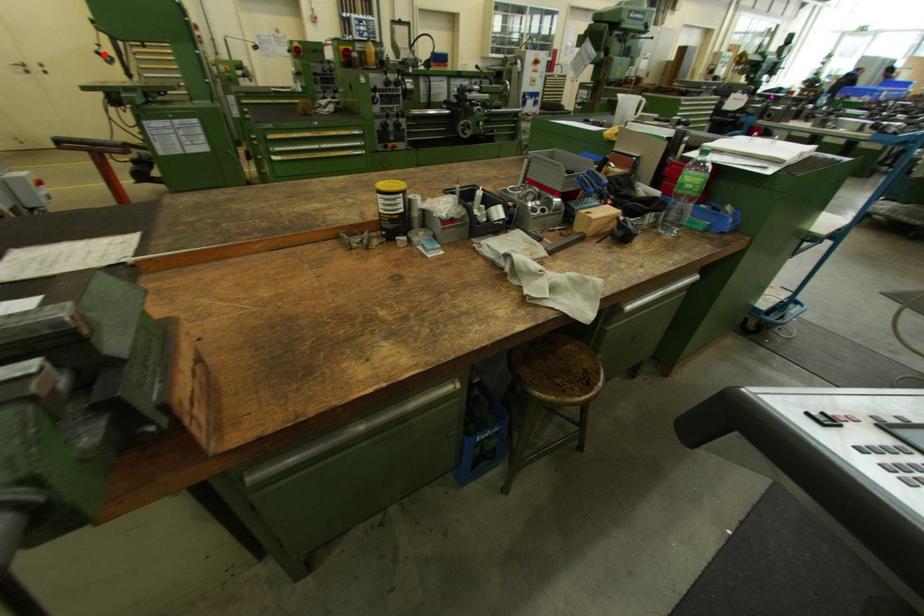
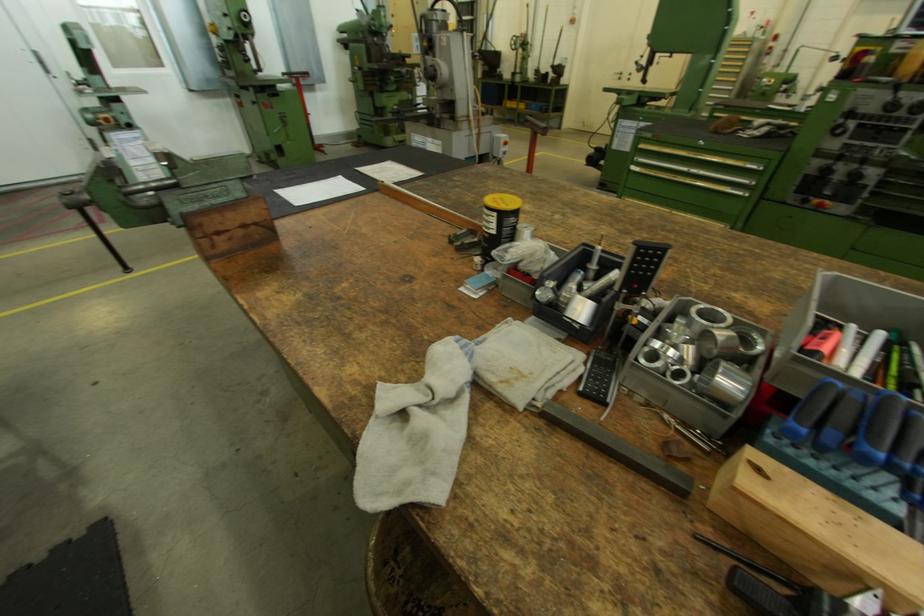
Question: I am providing you with two images of the same scene from different viewpoints. Image1 has a red point marked. In image2, the corresponding 3D location appears at what relative position? Reply with the corresponding letter.

Choices:
 (A) Closer
 (B) Farther

Answer: (A)